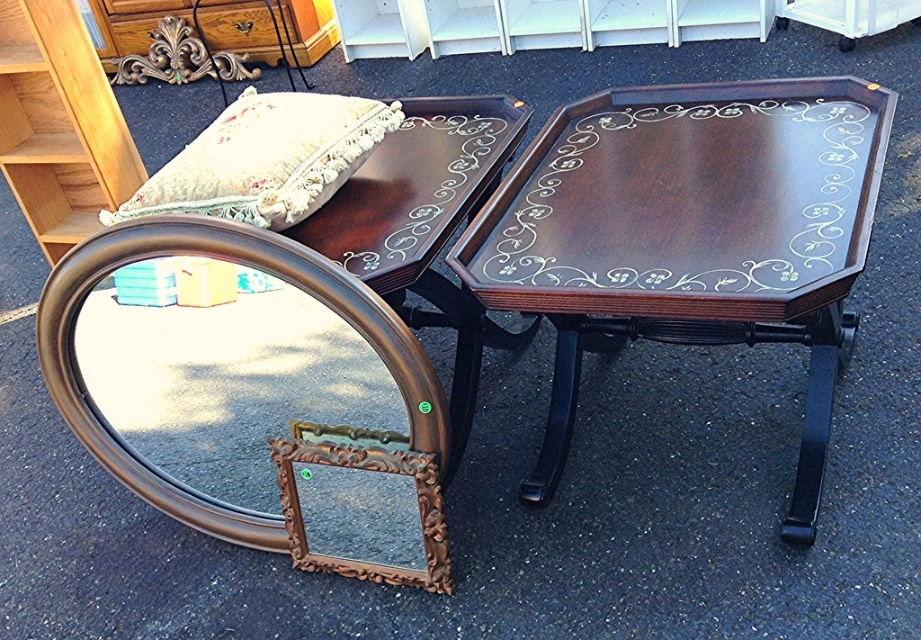
Does gold ornate mirror at center have a lesser height compared to light brown wood bookshelf at upper left?

Yes.

How distant is gold ornate mirror at center from light brown wood bookshelf at upper left?

gold ornate mirror at center is 1.26 meters from light brown wood bookshelf at upper left.

Does point (132, 461) come behind point (48, 58)?

No, (132, 461) is in front of (48, 58).

This screenshot has height=640, width=921. In order to click on gold ornate mirror at center in this screenshot , I will do `click(234, 262)`.

Measure the distance from dark wood/inlaid table at center to velvet floral pillow at upper left.

dark wood/inlaid table at center and velvet floral pillow at upper left are 20.94 inches apart from each other.

Can you confirm if dark wood/inlaid table at center is smaller than velvet floral pillow at upper left?

No, dark wood/inlaid table at center is not smaller than velvet floral pillow at upper left.

What do you see at coordinates (689, 236) in the screenshot?
I see `dark wood/inlaid table at center` at bounding box center [689, 236].

Identify the location of dark wood/inlaid table at center. Image resolution: width=921 pixels, height=640 pixels. (689, 236).

The width and height of the screenshot is (921, 640). What do you see at coordinates (234, 262) in the screenshot? I see `gold ornate mirror at center` at bounding box center [234, 262].

Is gold ornate mirror at center thinner than brushed metal drawer at upper left?

Yes.

You are a GUI agent. You are given a task and a screenshot of the screen. Output one action in this format:
    pyautogui.click(x=<x>, y=<y>)
    Task: Click on the gold ornate mirror at center
    
    Given the screenshot: What is the action you would take?
    pyautogui.click(x=234, y=262)